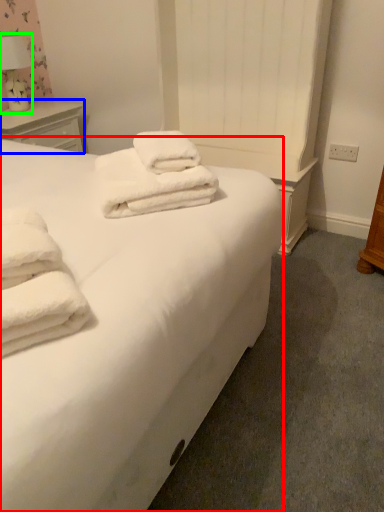
Question: Considering the real-world distances, which object is closest to bed (highlighted by a red box)? nightstand (highlighted by a blue box) or table lamp (highlighted by a green box).

Choices:
 (A) nightstand
 (B) table lamp

Answer: (A)